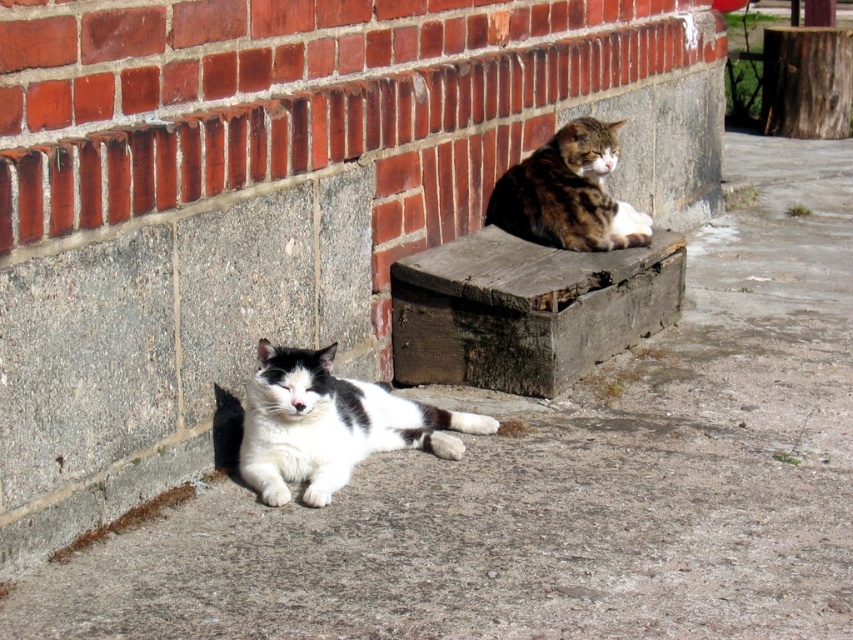
You are a photographer trying to capture both the weathered wood bench at upper center and the white soft fur cat at lower left in the same frame. Which object is closer to the camera, and why?

The white soft fur cat at lower left is closer to the camera because the weathered wood bench at upper center is positioned over it, indicating that the bench is in a more distant plane.

You are standing at the entrance of the garden and want to place a small potted plant on the weathered wood bench at upper center. Based on the image, can you confirm if there is enough space on the bench to accommodate the plant?

The weathered wood bench at upper center is located at point [526,308], but without knowing the bench dimensions or the plant size, it is impossible to determine if there is enough space. Please provide more details about the bench size or the plant dimensions to make an accurate assessment.

You are a photographer trying to capture both the white soft fur cat at lower left and the tabby fur cat at upper center in a single frame. Based on their positions, which cat is closer to the camera?

The white soft fur cat at lower left is positioned under the tabby fur cat at upper center, so the white soft fur cat at lower left is closer to the camera.